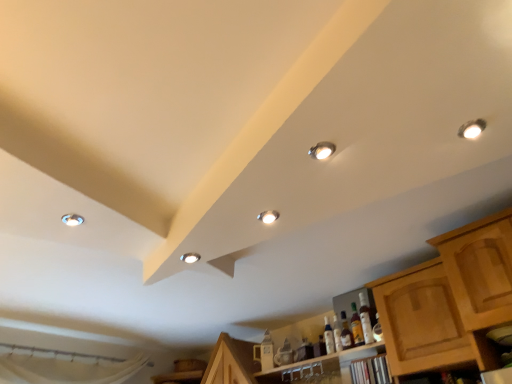
Question: Is matte white droplight at upper left, acting as the 3th droplight starting from the top, inside the boundaries of wooden cabinet at lower right, or outside?

Choices:
 (A) inside
 (B) outside

Answer: (B)

Question: Is matte white droplight at upper left, acting as the 3th droplight starting from the top, wider or thinner than wooden cabinet at lower right?

Choices:
 (A) wide
 (B) thin

Answer: (B)

Question: Based on their relative distances, which object is farther from the translucent amber bottle at center, the 2th bottle positioned from the left?

Choices:
 (A) translucent glass bottle at center, the 1th bottle viewed from the right
 (B) matte silver droplight at upper right, arranged as the fourth droplight when viewed from the back
 (C) clear glass bottle at lower center, the 3th bottle when ordered from right to left
 (D) matte white droplight at upper left, the second droplight ordered from the bottom
 (E) matte silver droplight at center, marked as the third droplight in a bottom-to-top arrangement

Answer: (D)

Question: Estimate the real-world distances between objects in this image. Which object is farther from the translucent amber bottle at center, which is the 2th bottle in right-to-left order?

Choices:
 (A) matte white droplight at upper left, the second droplight ordered from the bottom
 (B) matte silver droplight at center, placed as the third droplight when sorted from left to right
 (C) matte silver droplight at upper right, arranged as the fourth droplight when viewed from the back
 (D) matte silver droplight at center, placed as the 4th droplight when sorted from front to back
 (E) translucent glass bottle at center, the 1th bottle viewed from the right

Answer: (A)